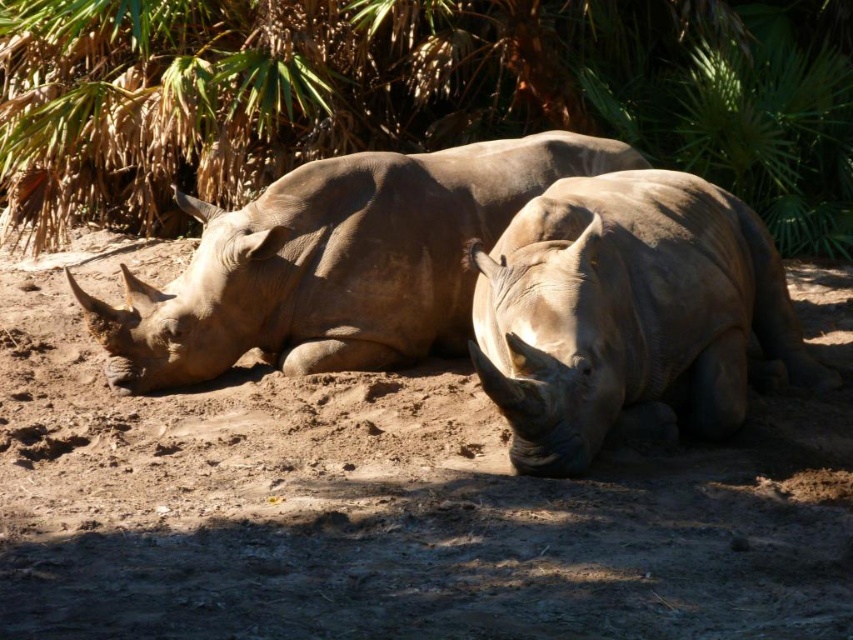
You are standing in front of the two rhinoceroses on the sandy ground. You want to locate the green leafy tree at upper center. In which direction should you look?

The green leafy tree at upper center is located at point coordinates of 0.153 on the x axis and 0.485 on the y axis. Since the coordinates are between 0 and 1, the tree is positioned to the left of the center horizontally and slightly below the top vertically. Therefore, you should look towards the upper left direction to find the green leafy tree at upper center.

You are a researcher studying the habitat of the rhinoceroses. You need to collect a soil sample from the brown sandy dirt at center. Where exactly should you collect the sample?

The brown sandy dirt at center is located at point (x=381, y=502), so you should collect the sample from that coordinate.

You are a wildlife photographer aiming to capture a closeup of the smooth gray rhino at center. Your camera is currently focused on the point at coordinates point (335, 262). Is this point likely to be on the smooth gray rhino at center?

Yes, the point (335, 262) corresponds to the smooth gray rhino at center, so the camera is focused on the correct subject.